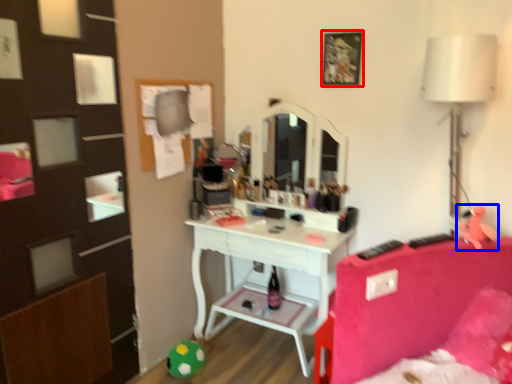
Question: Which point is further to the camera, picture frame (highlighted by a red box) or toy (highlighted by a blue box)?

Choices:
 (A) picture frame
 (B) toy

Answer: (A)